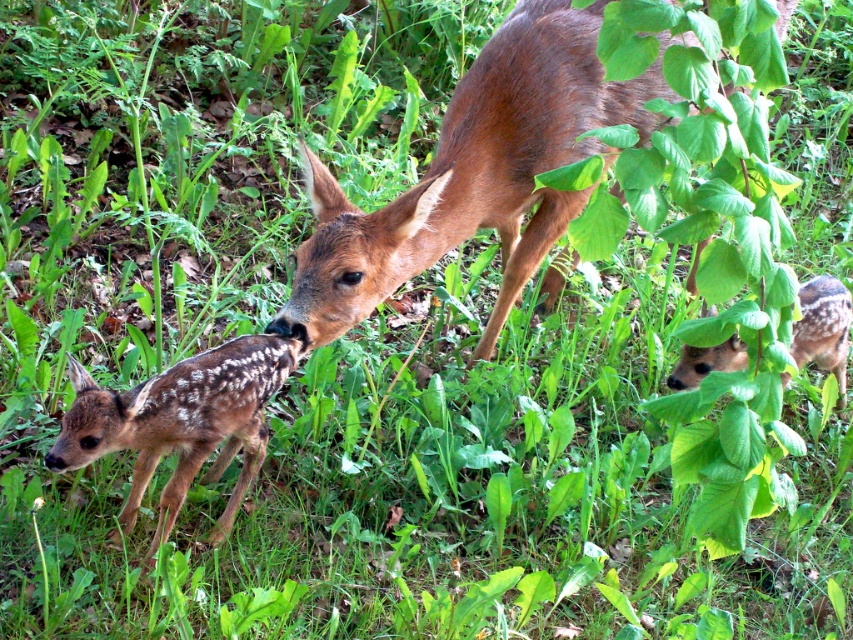
Looking at this image, you are a wildlife photographer aiming to capture a photo of the brown furry deer at center and the brown speckled fawn at lower left. Based on their sizes, which animal should you focus on first to ensure they both fit in the frame?

The brown furry deer at center is wider than the brown speckled fawn at lower left, so you should focus on the brown furry deer at center first to ensure both fit in the frame.

You are a wildlife photographer holding a camera. You want to take a photo of the brown furry deer at center from a distance that won t startle it. According to wildlife guidelines, you should keep at least 3 meters away from the deer. Can you take the photo without moving closer?

The brown furry deer at center and camera are 2.50 meters apart, which is less than the required 3 meters. Therefore, you cannot take the photo without moving closer to maintain the safe distance.

You are a wildlife photographer observing the scene. You need to capture a photo that includes both the brown furry deer at center and the brown speckled fawn at lower left. Based on their positions, which deer should be placed on the right side in your camera frame?

The brown furry deer at center should be placed on the right side in your camera frame because it is positioned on the right side of the brown speckled fawn at lower left.